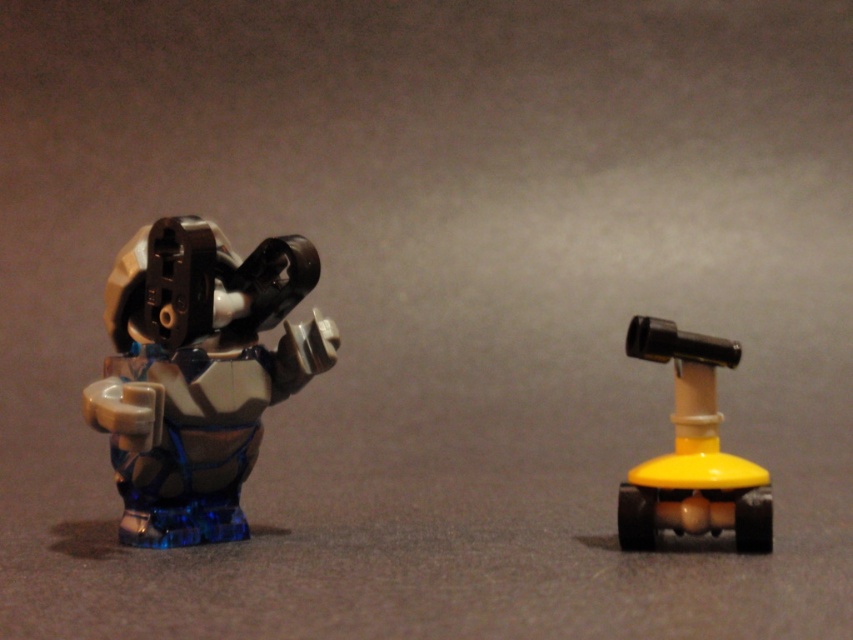
Who is positioned more to the right, translucent blue plastic robot at left or yellow matte telescope at right?

Positioned to the right is yellow matte telescope at right.

Does point (155, 449) come in front of point (647, 532)?

That is False.

You are a GUI agent. You are given a task and a screenshot of the screen. Output one action in this format:
    pyautogui.click(x=<x>, y=<y>)
    Task: Click on the translucent blue plastic robot at left
    This screenshot has height=640, width=853.
    Given the screenshot: What is the action you would take?
    pyautogui.click(x=198, y=372)